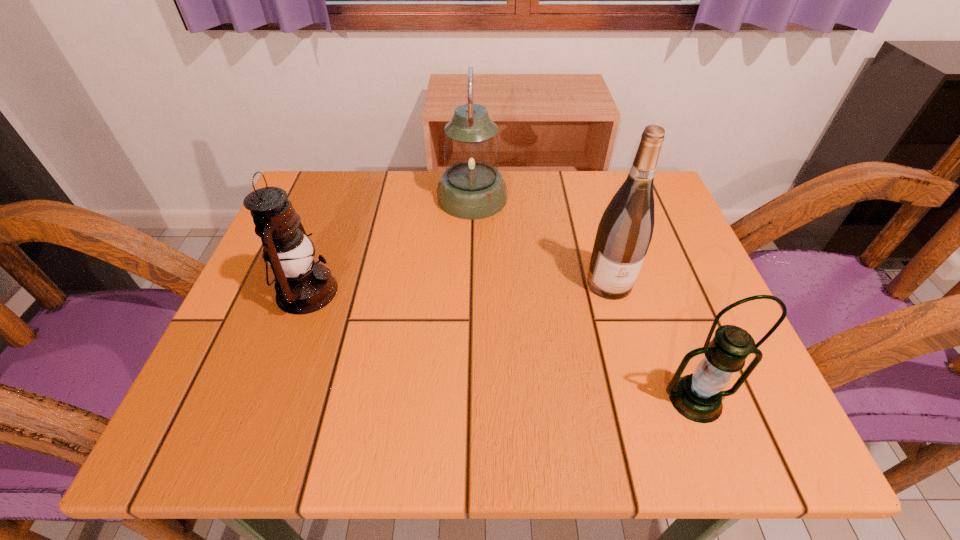
Image resolution: width=960 pixels, height=540 pixels. In order to click on object that is at the far edge in this screenshot , I will do `click(471, 188)`.

Where is `object that is at the near edge`? The width and height of the screenshot is (960, 540). object that is at the near edge is located at coordinates (698, 397).

Identify the location of object that is at the left edge. The width and height of the screenshot is (960, 540). (287, 248).

Where is `wine bottle that is positioned at the right edge`? The image size is (960, 540). wine bottle that is positioned at the right edge is located at coordinates (624, 233).

This screenshot has height=540, width=960. In order to click on lantern situated at the right edge in this screenshot , I will do `click(698, 397)`.

Where is `object present at the near right corner`? This screenshot has height=540, width=960. object present at the near right corner is located at coordinates (698, 397).

Find the location of a particular element. This screenshot has width=960, height=540. vacant space at the far edge of the desktop is located at coordinates (432, 214).

Identify the location of vacant space at the near edge of the desktop. (480, 425).

Where is `vacant space at the left edge`? vacant space at the left edge is located at coordinates (252, 361).

Image resolution: width=960 pixels, height=540 pixels. What are the coordinates of `free point at the right edge` in the screenshot? It's located at (656, 368).